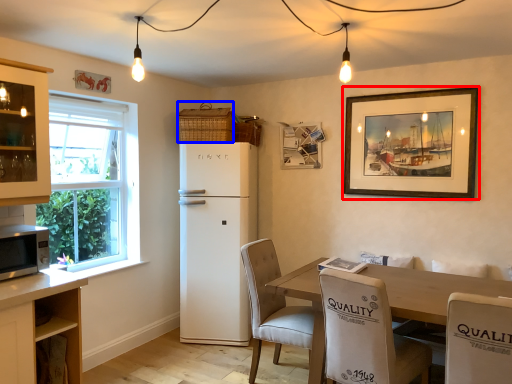
Question: Which object appears closest to the camera in this image, picture frame (highlighted by a red box) or basket (highlighted by a blue box)?

Choices:
 (A) picture frame
 (B) basket

Answer: (A)